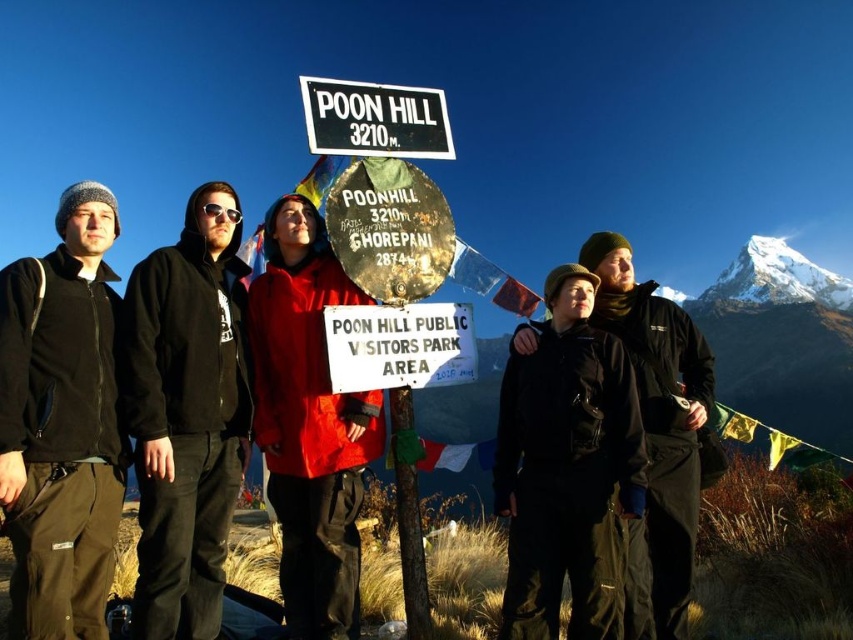
Question: Does red matte jacket at center appear on the left side of white plastic sign at center?

Choices:
 (A) no
 (B) yes

Answer: (B)

Question: Which object is positioned closest to the white snow-covered peak at upper right?

Choices:
 (A) red matte jacket at center
 (B) matte black jacket at left
 (C) white plastic sign at center

Answer: (A)

Question: Can you confirm if black fleece jacket at left is wider than white snow-covered peak at upper right?

Choices:
 (A) yes
 (B) no

Answer: (B)

Question: Considering the relative positions of matte black jacket at left and black plastic sign at upper center in the image provided, where is matte black jacket at left located with respect to black plastic sign at upper center?

Choices:
 (A) right
 (B) left

Answer: (B)

Question: Which object is positioned closest to the black fleece jacket at left?

Choices:
 (A) red matte jacket at center
 (B) matte black jacket at left
 (C) black plastic sign at upper center

Answer: (B)

Question: Based on their relative distances, which object is farther from the black plastic sign at upper center?

Choices:
 (A) white plastic sign at center
 (B) red matte jacket at center
 (C) matte black jacket at left

Answer: (C)